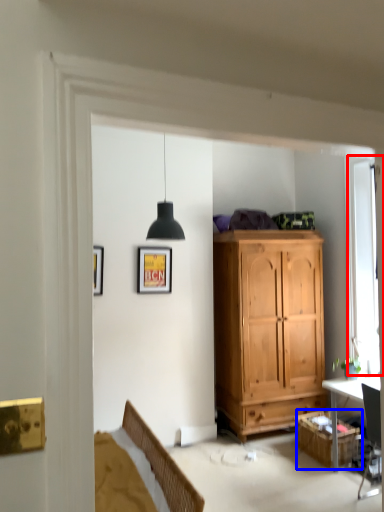
Question: Which point is further to the camera, window (highlighted by a red box) or cabinetry (highlighted by a blue box)?

Choices:
 (A) window
 (B) cabinetry

Answer: (A)